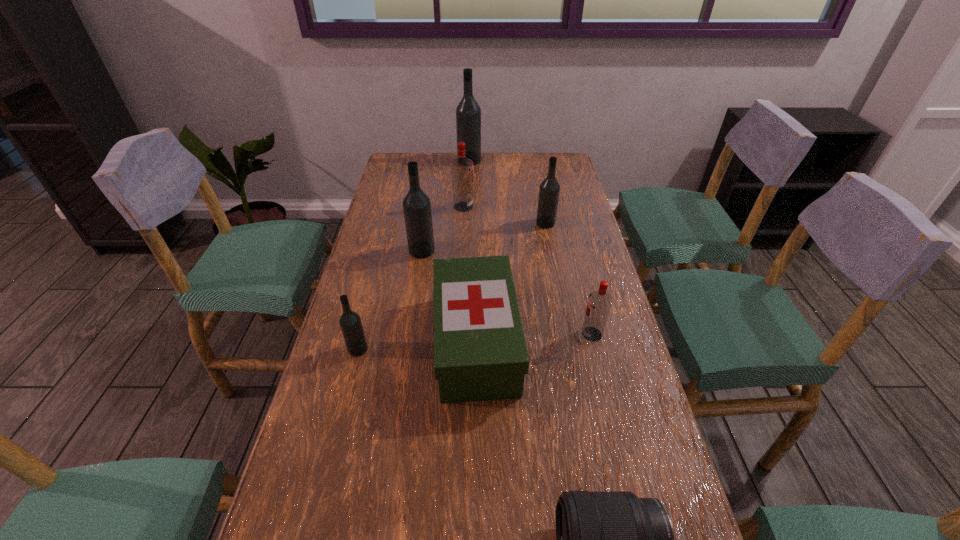
Locate an element on the screen. The image size is (960, 540). the seventh closest object to the nearest object is located at coordinates (468, 113).

Identify which object is the third nearest to the smaller red vodka. Please provide its 2D coordinates. Your answer should be formatted as a tuple, i.e. [(x, y)], where the tuple contains the x and y coordinates of a point satisfying the conditions above.

[(549, 190)]

Identify which vodka is the nearest to the leftmost vodka. Please provide its 2D coordinates. Your answer should be formatted as a tuple, i.e. [(x, y)], where the tuple contains the x and y coordinates of a point satisfying the conditions above.

[(416, 205)]

Identify the location of vodka that is the fifth closest one to the second vodka from right to left. (350, 322).

The image size is (960, 540). What are the coordinates of `black vodka that is the third closest to the first-aid kit` in the screenshot? It's located at (549, 190).

Select which black vodka appears as the third closest to the nearest object. Please provide its 2D coordinates. Your answer should be formatted as a tuple, i.e. [(x, y)], where the tuple contains the x and y coordinates of a point satisfying the conditions above.

[(549, 190)]

Locate an element on the screen. The width and height of the screenshot is (960, 540). free location that satisfies the following two spatial constraints: 1. on the back side of the nearest black vodka; 2. on the left side of the rightmost black vodka is located at coordinates (391, 223).

I want to click on free space in the image that satisfies the following two spatial constraints: 1. on the front label of the sixth nearest object; 2. on the left side of the farther red vodka, so click(463, 223).